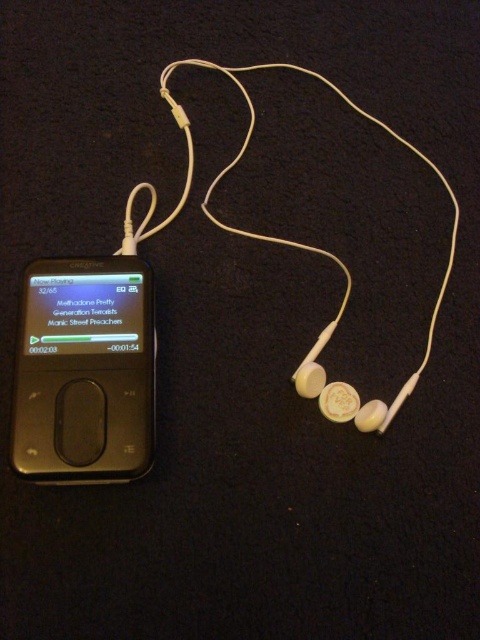
Question: Is gold plastic ipod at center closer to camera compared to white matte earphone at center?

Choices:
 (A) no
 (B) yes

Answer: (B)

Question: Where is gold plastic ipod at center located in relation to white matte earphone at center in the image?

Choices:
 (A) below
 (B) above

Answer: (B)

Question: Which object is closer to the camera taking this photo?

Choices:
 (A) gold plastic ipod at center
 (B) white matte earphone at center

Answer: (A)

Question: Can you confirm if gold plastic ipod at center is thinner than white matte earphone at center?

Choices:
 (A) yes
 (B) no

Answer: (B)

Question: Among these points, which one is nearest to the camera?

Choices:
 (A) [365, 426]
 (B) [151, 324]

Answer: (A)